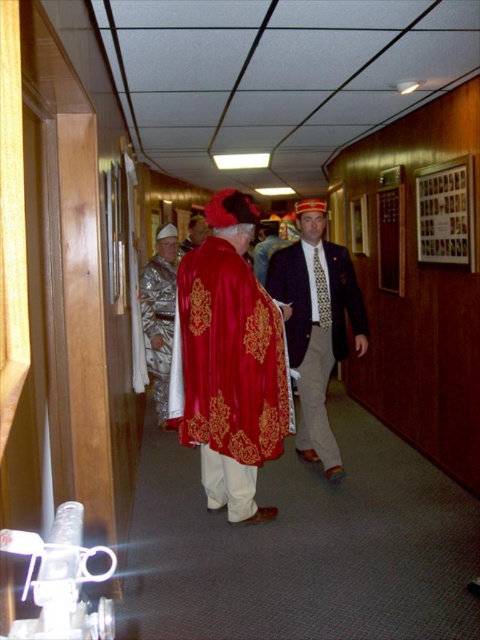
You are standing at the entrance of the hallway and see the point marked at (158, 324). What object is located at that point?

The point at (158, 324) corresponds to the velvet gold robe at center.

You are standing in the hallway and see the point marked at coordinate (228, 372). What is located at that point?

The point at coordinate (228, 372) is located at the center of the velvet gold.

From the picture: You are an event planner arranging a photo shoot in the hallway. You need to position a 1.8m tall photographer between the velvet gold at center and the velvet red cape at center. Which object should the photographer stand closer to to ensure both are in frame?

The velvet gold at center is taller than the velvet red cape at center. To ensure both are in frame, the photographer should stand closer to the velvet red cape at center since it is shorter and requires less adjustment to include both in the shot.